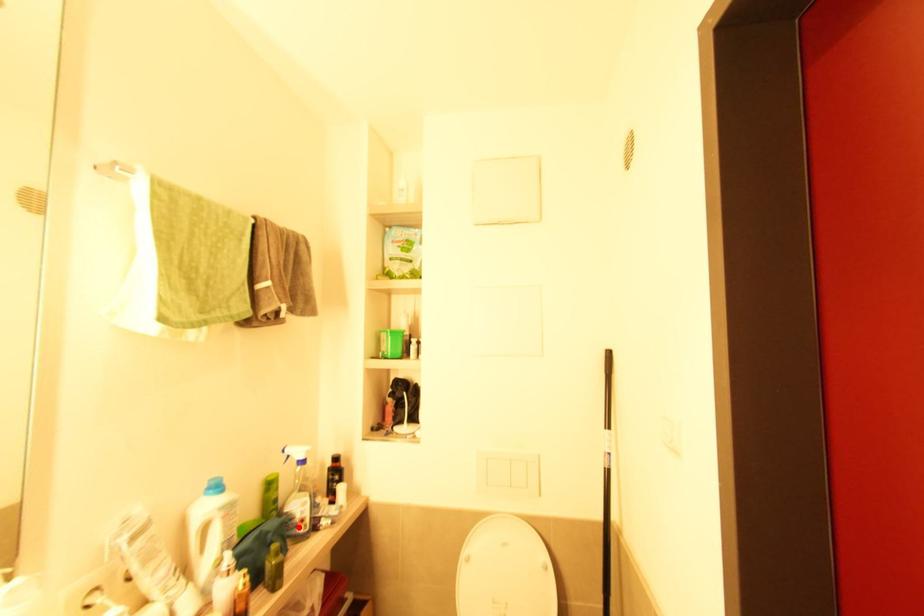
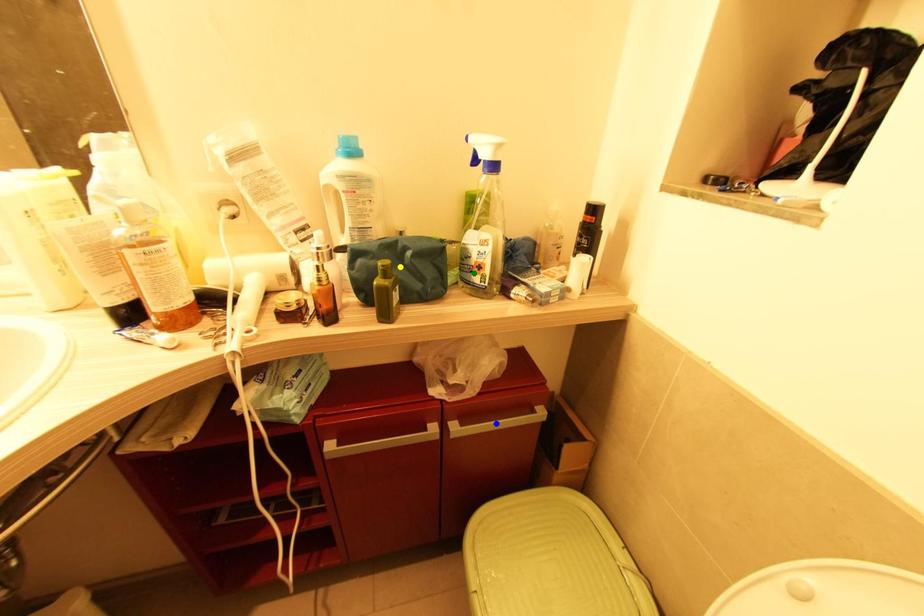
Question: I am providing you with two images of the same scene from different viewpoints. A red point is marked on the first image. You are given multiple points on the second image. Which point in image 2 is actually the same real-world point as the red point in image 1?

Choices:
 (A) green point
 (B) blue point
 (C) yellow point

Answer: (A)